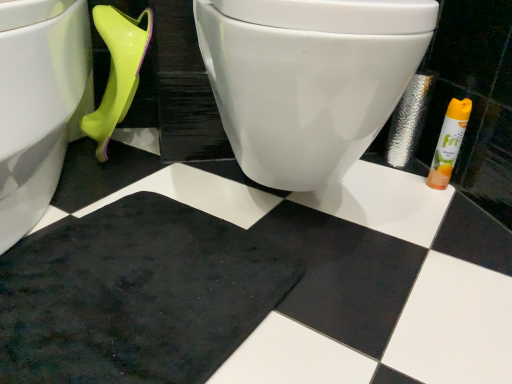
Question: Does black rubber bath mat at lower left appear on the left side of white glossy toilet at lower left, which is the 1th toilet in left-to-right order?

Choices:
 (A) yes
 (B) no

Answer: (B)

Question: Can you confirm if black rubber bath mat at lower left is smaller than white glossy toilet at lower left, which is the 1th toilet in left-to-right order?

Choices:
 (A) yes
 (B) no

Answer: (A)

Question: Is black rubber bath mat at lower left not close to white glossy toilet at lower left, the second toilet in the right-to-left sequence?

Choices:
 (A) yes
 (B) no

Answer: (B)

Question: Can you confirm if black rubber bath mat at lower left is thinner than white glossy toilet at lower left, the second toilet in the right-to-left sequence?

Choices:
 (A) yes
 (B) no

Answer: (A)

Question: Considering the relative sizes of black rubber bath mat at lower left and white glossy toilet at lower left, which is the 1th toilet in left-to-right order, in the image provided, is black rubber bath mat at lower left wider than white glossy toilet at lower left, which is the 1th toilet in left-to-right order,?

Choices:
 (A) yes
 (B) no

Answer: (B)

Question: Does black rubber bath mat at lower left appear on the right side of white glossy toilet at lower left, the second toilet in the right-to-left sequence?

Choices:
 (A) yes
 (B) no

Answer: (A)

Question: Would you say orange matte air freshener at right is a long distance from white glossy toilet at center, which is counted as the 1th toilet, starting from the right?

Choices:
 (A) yes
 (B) no

Answer: (B)

Question: From the image's perspective, is orange matte air freshener at right located beneath white glossy toilet at center, which is the 2th toilet from left to right?

Choices:
 (A) yes
 (B) no

Answer: (A)

Question: Is orange matte air freshener at right closer to camera compared to white glossy toilet at center, which is counted as the 1th toilet, starting from the right?

Choices:
 (A) yes
 (B) no

Answer: (B)

Question: Does orange matte air freshener at right have a larger size compared to white glossy toilet at center, which is counted as the 1th toilet, starting from the right?

Choices:
 (A) yes
 (B) no

Answer: (B)

Question: Is orange matte air freshener at right behind white glossy toilet at center, which is the 2th toilet from left to right?

Choices:
 (A) yes
 (B) no

Answer: (A)

Question: Is orange matte air freshener at right wider than white glossy toilet at center, which is counted as the 1th toilet, starting from the right?

Choices:
 (A) yes
 (B) no

Answer: (B)

Question: Does orange matte air freshener at right have a smaller size compared to white glossy toilet at lower left, the second toilet in the right-to-left sequence?

Choices:
 (A) yes
 (B) no

Answer: (A)